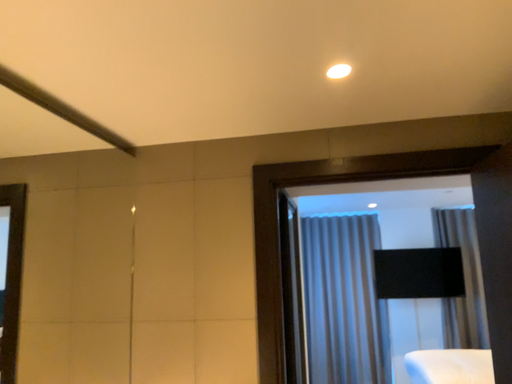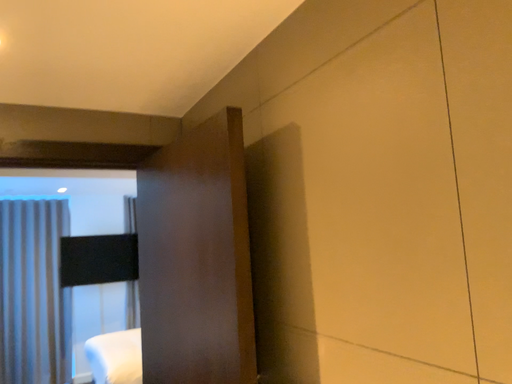
Question: How did the camera likely rotate when shooting the video?

Choices:
 (A) rotated left
 (B) rotated right

Answer: (B)